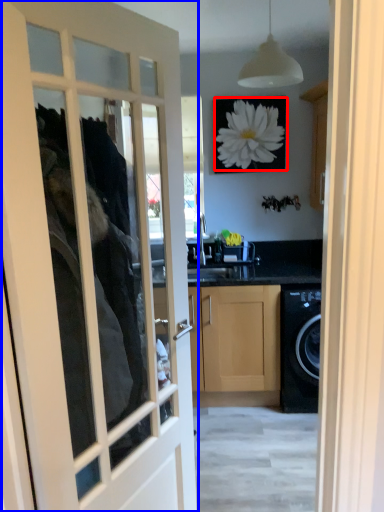
Question: Which point is further to the camera, flower (highlighted by a red box) or door (highlighted by a blue box)?

Choices:
 (A) flower
 (B) door

Answer: (A)